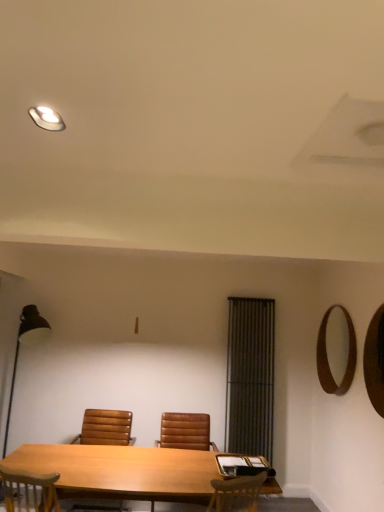
The image size is (384, 512). I want to click on wooden mirror at right, the 1th mirror from the front, so click(375, 361).

The width and height of the screenshot is (384, 512). Describe the element at coordinates (185, 432) in the screenshot. I see `brown leather chair at center, arranged as the 2th chair when viewed from the left` at that location.

Describe the element at coordinates (327, 356) in the screenshot. I see `brown wooden mirror at upper right, which is the first mirror from back to front` at that location.

Locate an element on the screen. This screenshot has width=384, height=512. black fabric curtain at center is located at coordinates (250, 377).

This screenshot has width=384, height=512. In order to click on light brown wood table at center in this screenshot , I will do `click(122, 471)`.

At what (x,y) coordinates should I click in order to perform the action: click on black metal floor lamp at left. Please return your answer as a coordinate pair (x, y). Image resolution: width=384 pixels, height=512 pixels. Looking at the image, I should click on (26, 344).

From the picture: Would you consider brown leather chair at center, placed as the first chair when sorted from left to right, to be distant from light brown wood table at center?

brown leather chair at center, placed as the first chair when sorted from left to right, is far away from light brown wood table at center.

Is brown leather chair at center, placed as the first chair when sorted from left to right, oriented towards light brown wood table at center?

Yes, brown leather chair at center, placed as the first chair when sorted from left to right, faces towards light brown wood table at center.

Which is in front, brown leather chair at center, placed as the first chair when sorted from left to right, or light brown wood table at center?

light brown wood table at center is more forward.

Can you confirm if brown leather chair at center, arranged as the second chair when viewed from the right, is shorter than light brown wood table at center?

No, brown leather chair at center, arranged as the second chair when viewed from the right, is not shorter than light brown wood table at center.

Which of these two, black fabric curtain at center or wooden mirror at right, the 1th mirror from the front, is bigger?

Bigger between the two is black fabric curtain at center.

Which is less distant, (260,329) or (370,367)?

The point (370,367) is in front.

Could you tell me if black fabric curtain at center is facing wooden mirror at right, the 1th mirror from the front?

No, black fabric curtain at center is not aimed at wooden mirror at right, the 1th mirror from the front.

Could you tell me if black metal floor lamp at left is facing black fabric curtain at center?

No.

Looking at this image, is black metal floor lamp at left spatially inside black fabric curtain at center, or outside of it?

black metal floor lamp at left is not enclosed by black fabric curtain at center.

Does black metal floor lamp at left have a greater width compared to black fabric curtain at center?

Yes, black metal floor lamp at left is wider than black fabric curtain at center.

From a real-world perspective, who is located higher, black metal floor lamp at left or black fabric curtain at center?

black fabric curtain at center.

From a real-world perspective, does black fabric curtain at center sit lower than light brown wood table at center?

No, from a real-world perspective, black fabric curtain at center is not under light brown wood table at center.

Based on the photo, is black fabric curtain at center aimed at light brown wood table at center?

No, black fabric curtain at center is not oriented towards light brown wood table at center.

Is black fabric curtain at center surrounding light brown wood table at center?

No, light brown wood table at center is not surrounded by black fabric curtain at center.

Is wooden mirror at right, the 1th mirror from the front, positioned beyond the bounds of light brown wood table at center?

Yes, wooden mirror at right, the 1th mirror from the front, is located beyond the bounds of light brown wood table at center.

From a real-world perspective, relative to light brown wood table at center, is wooden mirror at right, the second mirror from the back, vertically above or below?

From a real-world perspective, wooden mirror at right, the second mirror from the back, is physically above light brown wood table at center.

Between wooden mirror at right, the second mirror from the back, and light brown wood table at center, which one has smaller width?

Thinner between the two is wooden mirror at right, the second mirror from the back.

Does wooden mirror at right, the 1th mirror from the front, have a smaller size compared to light brown wood table at center?

Indeed, wooden mirror at right, the 1th mirror from the front, has a smaller size compared to light brown wood table at center.

Is black fabric curtain at center not within black metal floor lamp at left?

Absolutely, black fabric curtain at center is external to black metal floor lamp at left.

Does black fabric curtain at center turn towards black metal floor lamp at left?

No, black fabric curtain at center is not turned towards black metal floor lamp at left.

How distant is black fabric curtain at center from black metal floor lamp at left?

They are 7.28 feet apart.

Is black fabric curtain at center at the left side of black metal floor lamp at left?

No.

Is brown leather chair at center, arranged as the second chair when viewed from the right, wider than wooden mirror at right, the 1th mirror from the front?

Yes.

Is brown leather chair at center, placed as the first chair when sorted from left to right, oriented towards wooden mirror at right, the 1th mirror from the front?

No.

The width and height of the screenshot is (384, 512). What are the coordinates of `mirror in front of the brown leather chair at center, placed as the first chair when sorted from left to right` in the screenshot? It's located at [375, 361].

From the image's perspective, which chair is the 1st one below the light brown wood table at center? Please provide its 2D coordinates.

[(106, 428)]

Which mirror is the 2nd one when counting from the front of the black fabric curtain at center? Please provide its 2D coordinates.

[(375, 361)]

When comparing their distances from brown leather chair at center, arranged as the second chair when viewed from the right, does light brown wood table at center or black metal floor lamp at left seem closer?

light brown wood table at center.

Based on their spatial positions, is black fabric curtain at center or brown leather chair at center, the first chair in the right-to-left sequence, further from black metal floor lamp at left?

Among the two, black fabric curtain at center is located further to black metal floor lamp at left.

When comparing their distances from light brown wood table at center, does brown leather chair at center, the first chair in the right-to-left sequence, or wooden mirror at right, the 1th mirror from the front, seem further?

The object further to light brown wood table at center is wooden mirror at right, the 1th mirror from the front.

Looking at the image, which one is located further to brown leather chair at center, placed as the first chair when sorted from left to right, brown leather chair at center, arranged as the 2th chair when viewed from the left, or black metal floor lamp at left?

Based on the image, black metal floor lamp at left appears to be further to brown leather chair at center, placed as the first chair when sorted from left to right.

From the image, which object appears to be farther from black fabric curtain at center, matte white light fixture at upper left or black metal floor lamp at left?

The object further to black fabric curtain at center is matte white light fixture at upper left.

From the image, which object appears to be farther from brown leather chair at center, placed as the first chair when sorted from left to right, black fabric curtain at center or black metal floor lamp at left?

black fabric curtain at center.

Estimate the real-world distances between objects in this image. Which object is closer to brown leather chair at center, arranged as the 2th chair when viewed from the left, brown wooden mirror at upper right, which ranks as the second mirror in front-to-back order, or wooden mirror at right, the second mirror from the back?

brown wooden mirror at upper right, which ranks as the second mirror in front-to-back order, is positioned closer to the anchor brown leather chair at center, arranged as the 2th chair when viewed from the left.

Based on their spatial positions, is black metal floor lamp at left or black fabric curtain at center further from brown wooden mirror at upper right, which is the first mirror from back to front?

black metal floor lamp at left is positioned further to the anchor brown wooden mirror at upper right, which is the first mirror from back to front.

At what (x,y) coordinates should I click in order to perform the action: click on chair between light brown wood table at center and brown wooden mirror at upper right, which is the first mirror from back to front. Please return your answer as a coordinate pair (x, y). Looking at the image, I should click on (185, 432).

Locate an element on the screen. The width and height of the screenshot is (384, 512). table located between matte white light fixture at upper left and black fabric curtain at center in the depth direction is located at coordinates tap(122, 471).

I want to click on curtain located between brown leather chair at center, arranged as the second chair when viewed from the right, and wooden mirror at right, the second mirror from the back, in the left-right direction, so click(x=250, y=377).

At what (x,y) coordinates should I click in order to perform the action: click on table lamp between matte white light fixture at upper left and black fabric curtain at center in the front-back direction. Please return your answer as a coordinate pair (x, y). Looking at the image, I should click on (26, 344).